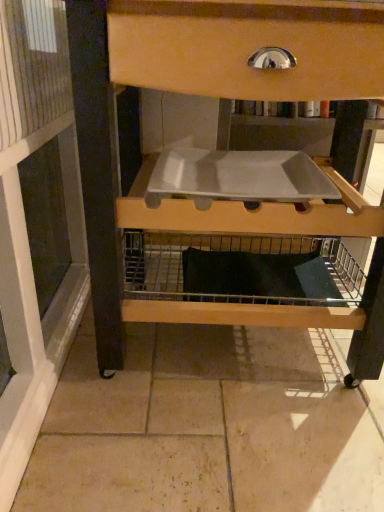
Question: From a real-world perspective, is white plastic tray at center over wooden drawer at upper center?

Choices:
 (A) yes
 (B) no

Answer: (A)

Question: Does white plastic tray at center have a greater height compared to wooden drawer at upper center?

Choices:
 (A) yes
 (B) no

Answer: (B)

Question: Is white plastic tray at center not close to wooden drawer at upper center?

Choices:
 (A) no
 (B) yes

Answer: (A)

Question: Does white plastic tray at center appear on the left side of wooden drawer at upper center?

Choices:
 (A) no
 (B) yes

Answer: (B)

Question: Could you tell me if white plastic tray at center is facing wooden drawer at upper center?

Choices:
 (A) yes
 (B) no

Answer: (A)

Question: Does white plastic tray at center have a greater width compared to wooden drawer at upper center?

Choices:
 (A) no
 (B) yes

Answer: (A)

Question: Is wooden drawer at upper center facing towards white plastic tray at center?

Choices:
 (A) yes
 (B) no

Answer: (A)

Question: Is wooden drawer at upper center closer to the viewer compared to white plastic tray at center?

Choices:
 (A) yes
 (B) no

Answer: (A)

Question: From a real-world perspective, is wooden drawer at upper center on top of white plastic tray at center?

Choices:
 (A) yes
 (B) no

Answer: (B)

Question: Is wooden drawer at upper center beside white plastic tray at center?

Choices:
 (A) yes
 (B) no

Answer: (B)

Question: Is wooden drawer at upper center surrounding white plastic tray at center?

Choices:
 (A) yes
 (B) no

Answer: (A)

Question: Is wooden drawer at upper center positioned with its back to white plastic tray at center?

Choices:
 (A) no
 (B) yes

Answer: (B)

Question: Considering their positions, is white plastic tray at center located in front of or behind wooden drawer at upper center?

Choices:
 (A) behind
 (B) front

Answer: (A)